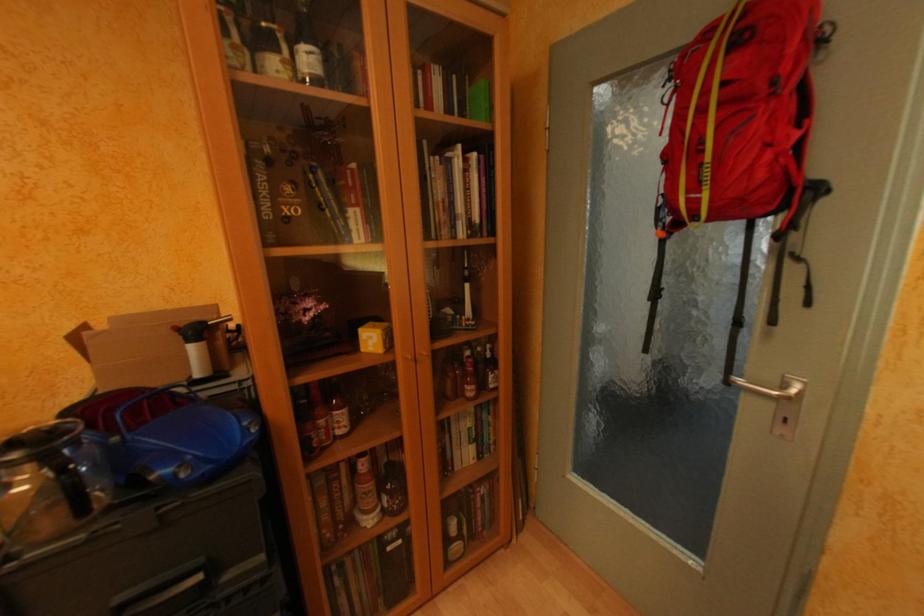
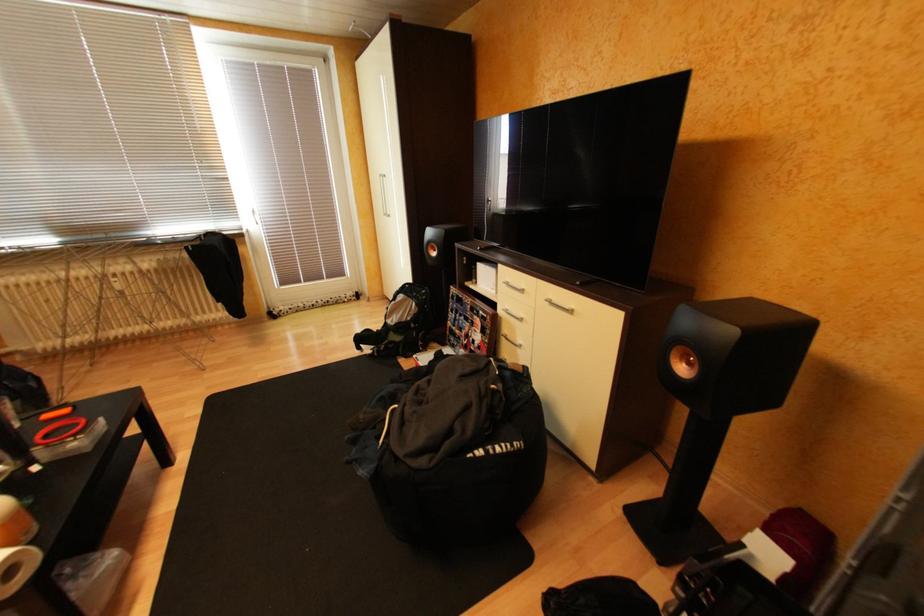
How did the camera likely rotate?

The camera rotated toward left-down.